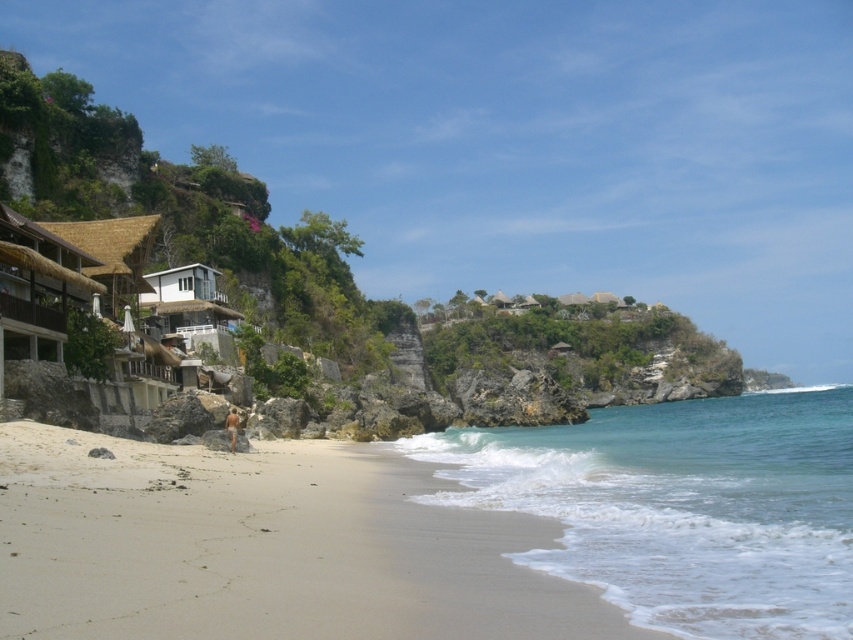
Does clear blue water at lower right come in front of brown skin at lower center?

Yes, it is in front of brown skin at lower center.

Does point (788, 600) lie in front of point (229, 445)?

Yes, point (788, 600) is closer to viewer.

Image resolution: width=853 pixels, height=640 pixels. Find the location of `clear blue water at lower right`. clear blue water at lower right is located at coordinates (683, 506).

From the picture: Between fine-grained sand at lower left and brown skin at lower center, which one has less height?

Standing shorter between the two is brown skin at lower center.

Identify the location of fine-grained sand at lower left. (264, 547).

At what (x,y) coordinates should I click in order to perform the action: click on fine-grained sand at lower left. Please return your answer as a coordinate pair (x, y). Looking at the image, I should click on (264, 547).

Identify the location of fine-grained sand at lower left. The height and width of the screenshot is (640, 853). (264, 547).

Is fine-grained sand at lower left smaller than clear blue water at lower right?

Indeed, fine-grained sand at lower left has a smaller size compared to clear blue water at lower right.

What do you see at coordinates (264, 547) in the screenshot? I see `fine-grained sand at lower left` at bounding box center [264, 547].

What are the coordinates of `fine-grained sand at lower left` in the screenshot? It's located at (264, 547).